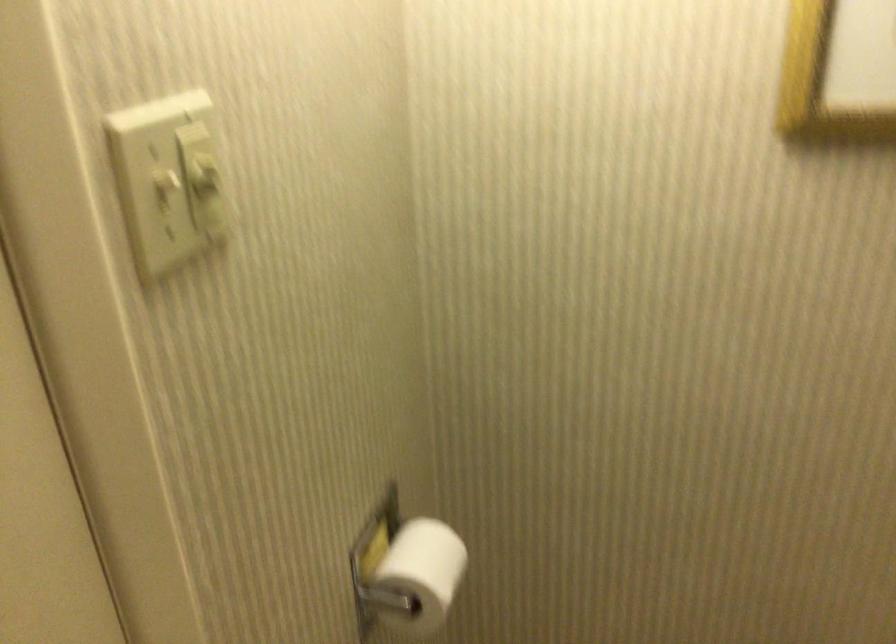
Which object does [421,573] point to?

It refers to a white toilet paper roll.